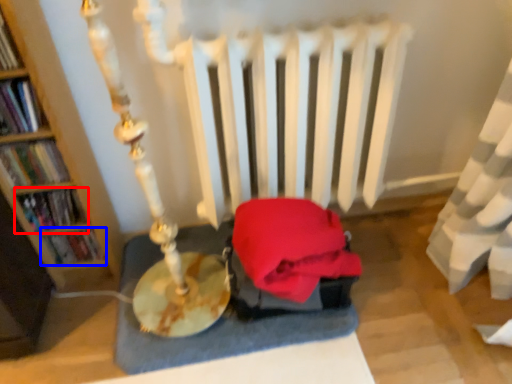
Question: Among these objects, which one is nearest to the camera, book (highlighted by a red box) or book (highlighted by a blue box)?

Choices:
 (A) book
 (B) book

Answer: (A)